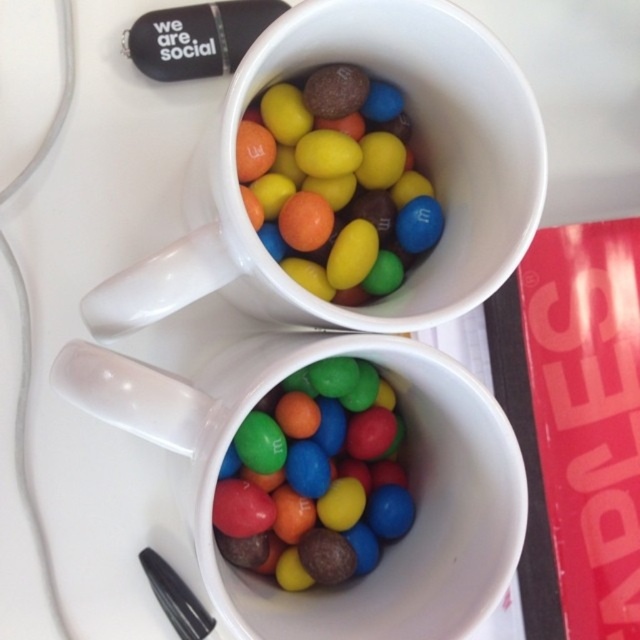
Does white ceramic mug at upper center appear over glossy ceramic mug at upper center?

Yes.

Does white ceramic mug at upper center have a lesser height compared to glossy ceramic mug at upper center?

Yes.

Identify the location of white ceramic mug at upper center. Image resolution: width=640 pixels, height=640 pixels. (419, 161).

Can you confirm if white ceramic mug at upper center is taller than glossy plastic m&m's at center?

Correct, white ceramic mug at upper center is much taller as glossy plastic m&m's at center.

Image resolution: width=640 pixels, height=640 pixels. What do you see at coordinates (419, 161) in the screenshot?
I see `white ceramic mug at upper center` at bounding box center [419, 161].

Locate an element on the screen. The image size is (640, 640). white ceramic mug at upper center is located at coordinates (419, 161).

Who is higher up, glossy chocolate candy at center or glossy plastic m&m's at center?

glossy chocolate candy at center

Between point (257, 216) and point (349, 566), which one is positioned in front?

Point (257, 216) is more forward.

This screenshot has height=640, width=640. In order to click on glossy chocolate candy at center in this screenshot , I will do `click(336, 182)`.